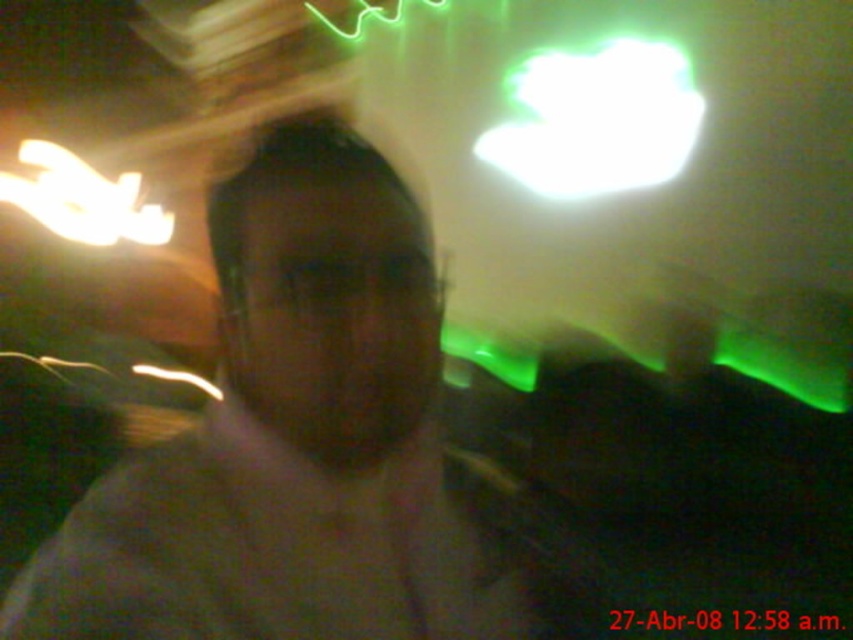
Question: Which point appears farthest from the camera in this image?

Choices:
 (A) (401, 419)
 (B) (442, 492)

Answer: (B)

Question: Does matte gray shirt at center have a greater width compared to dark gray cotton dress shirt at center?

Choices:
 (A) yes
 (B) no

Answer: (B)

Question: Is matte gray shirt at center positioned behind dark gray cotton dress shirt at center?

Choices:
 (A) no
 (B) yes

Answer: (A)

Question: Which point is farther from the camera taking this photo?

Choices:
 (A) (341, 422)
 (B) (440, 580)

Answer: (B)

Question: Which of the following is the farthest from the observer?

Choices:
 (A) (62, 580)
 (B) (318, 573)

Answer: (B)

Question: Is matte gray shirt at center closer to camera compared to dark gray cotton dress shirt at center?

Choices:
 (A) yes
 (B) no

Answer: (A)